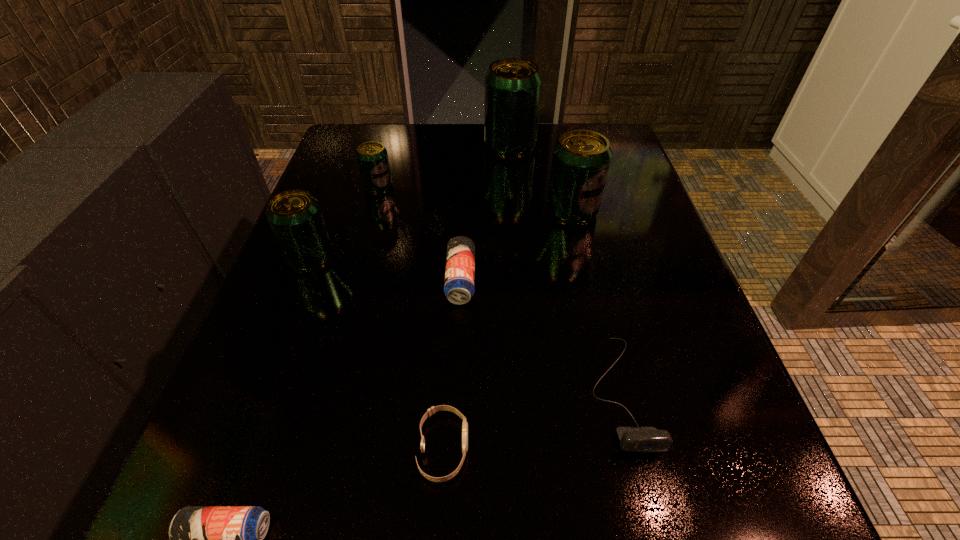
What are the coordinates of `vacant area between the farthest green beer can and the third farthest object` in the screenshot? It's located at (540, 179).

I want to click on empty space that is in between the fourth tallest beer can and the farthest green beer can, so click(x=444, y=167).

Where is `vacant area between the third tallest beer can and the watch`? Image resolution: width=960 pixels, height=540 pixels. vacant area between the third tallest beer can and the watch is located at coordinates tap(377, 353).

Locate an element on the screen. vacant point located between the farthest object and the third tallest beer can is located at coordinates (410, 202).

Find the location of a particular element. vacant space that is in between the watch and the sixth shortest object is located at coordinates (377, 353).

Locate an element on the screen. Image resolution: width=960 pixels, height=540 pixels. object that ranks as the sixth closest to the sixth nearest object is located at coordinates (430, 412).

Locate which object is the seventh closest to the webcam. Please provide its 2D coordinates. Your answer should be formatted as a tuple, i.e. [(x, y)], where the tuple contains the x and y coordinates of a point satisfying the conditions above.

[(513, 86)]

Locate an element on the screen. beer can that is the fifth closest to the webcam is located at coordinates [372, 157].

Locate an element on the screen. the sixth closest beer can relative to the watch is located at coordinates (513, 86).

Choose which green beer can is the third nearest neighbor to the right blue beer can. Please provide its 2D coordinates. Your answer should be formatted as a tuple, i.e. [(x, y)], where the tuple contains the x and y coordinates of a point satisfying the conditions above.

[(372, 157)]